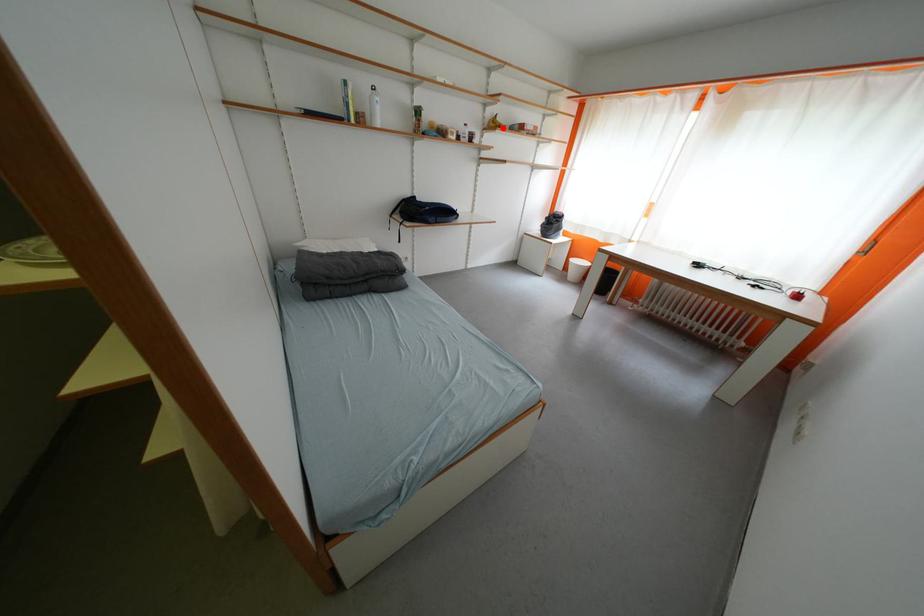
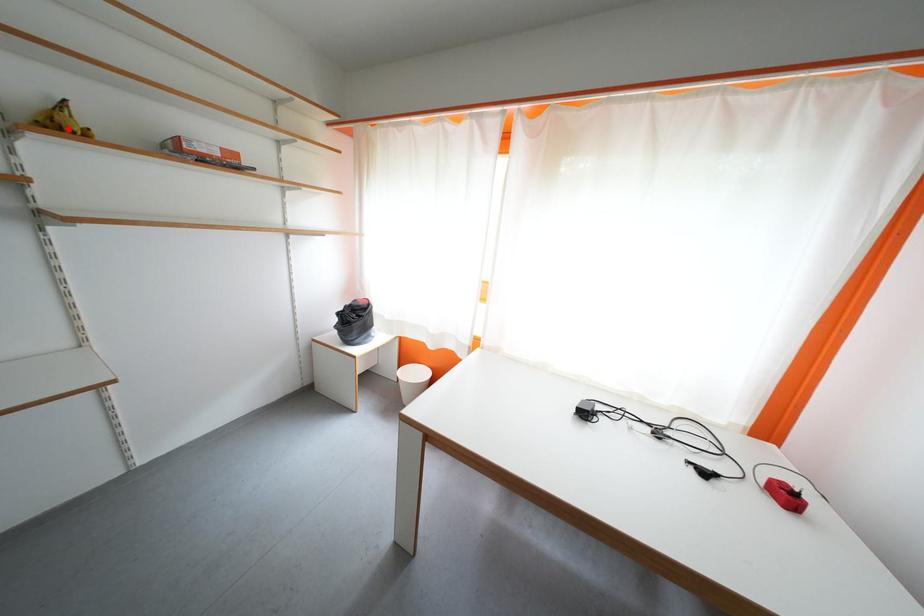
From the picture: I am providing you with two images of the same scene from different viewpoints. A red point is marked on the first image and another point is marked on the second image. Is the red point in image1 aligned with the point shown in image2?

Yes